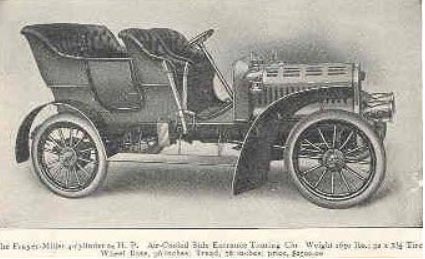
Locate an element on the screen. door is located at coordinates (106, 77).